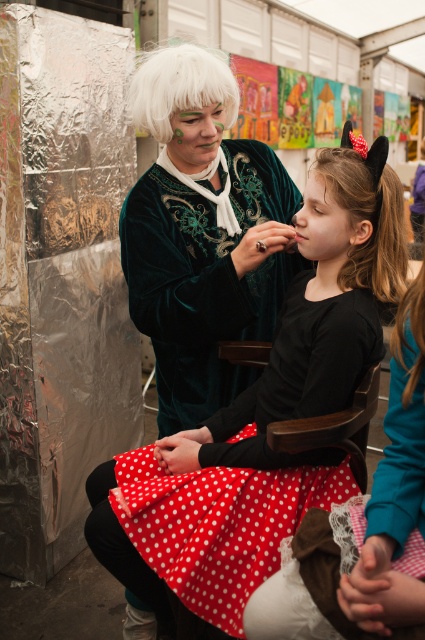
Question: Which point is closer to the camera?

Choices:
 (A) [405, 243]
 (B) [405, 403]
 (C) [215, 68]

Answer: (B)

Question: Can you confirm if brown silky hair at center is smaller than white fluffy wig at upper center?

Choices:
 (A) no
 (B) yes

Answer: (B)

Question: Which is nearer to the brown silky hair at center?

Choices:
 (A) brown silky hair at right
 (B) white fluffy wig at upper center
 (C) polka dot fabric dress at center

Answer: (C)

Question: Is velvet green dress at center closer to camera compared to brown silky hair at right?

Choices:
 (A) no
 (B) yes

Answer: (A)

Question: In this image, where is velvet green dress at center located relative to white fluffy wig at upper center?

Choices:
 (A) right
 (B) left

Answer: (A)

Question: Which point is farther to the camera?

Choices:
 (A) velvet green dress at center
 (B) brown silky hair at right
 (C) white fluffy wig at upper center

Answer: (A)